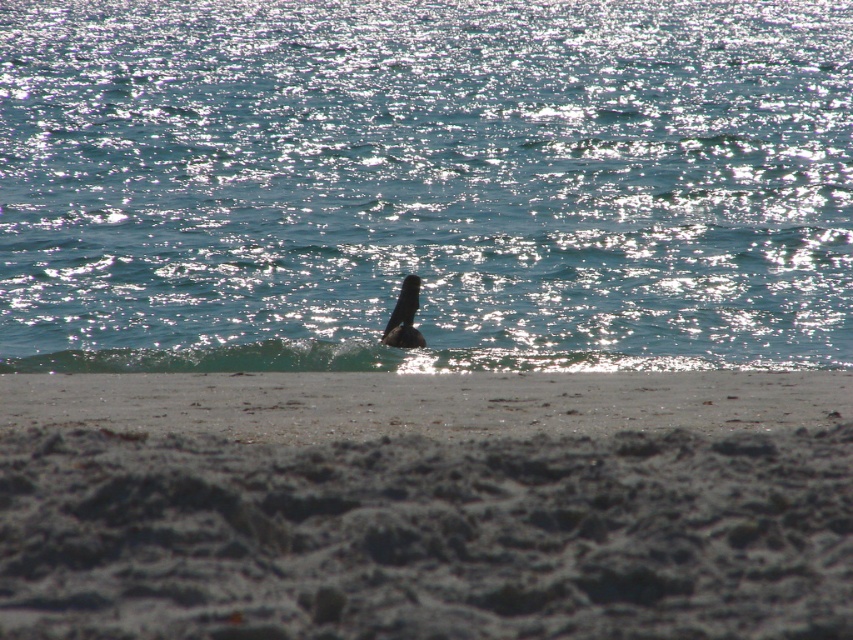
Which is below, shiny blue water at center or gray sandy beach at lower center?

gray sandy beach at lower center

Is shiny blue water at center below gray sandy beach at lower center?

Incorrect, shiny blue water at center is not positioned below gray sandy beach at lower center.

The width and height of the screenshot is (853, 640). Identify the location of shiny blue water at center. [424, 182].

You are a GUI agent. You are given a task and a screenshot of the screen. Output one action in this format:
    pyautogui.click(x=<x>, y=<y>)
    Task: Click on the shiny blue water at center
    Image resolution: width=853 pixels, height=640 pixels.
    Given the screenshot: What is the action you would take?
    coord(424,182)

Which of these two, gray sandy beach at lower center or smooth sand at lower center, stands taller?

gray sandy beach at lower center

Is gray sandy beach at lower center wider than smooth sand at lower center?

Yes, gray sandy beach at lower center is wider than smooth sand at lower center.

Is point (296, 582) farther from camera compared to point (282, 388)?

That is False.

Where is `gray sandy beach at lower center`? The width and height of the screenshot is (853, 640). gray sandy beach at lower center is located at coordinates (426, 504).

Does smooth sand at lower center have a smaller size compared to dark brown feathers at center?

Actually, smooth sand at lower center might be larger than dark brown feathers at center.

Which is below, smooth sand at lower center or dark brown feathers at center?

smooth sand at lower center

Between point (827, 424) and point (393, 340), which one is positioned in front?

Positioned in front is point (827, 424).

This screenshot has height=640, width=853. Find the location of `smooth sand at lower center`. smooth sand at lower center is located at coordinates (424, 403).